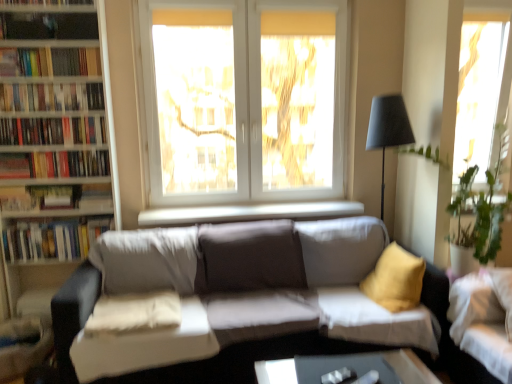
The width and height of the screenshot is (512, 384). Identify the location of empty space that is ontop of hardcover books at left, which is the fourth book from top to bottom. (71, 149).